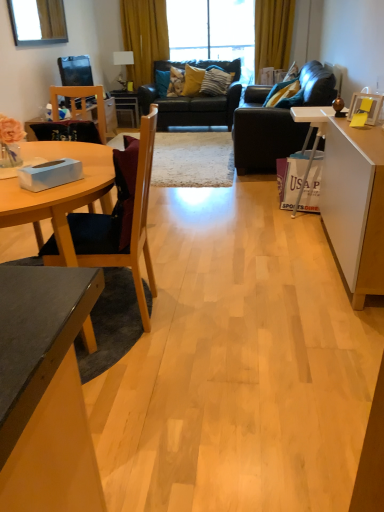
This screenshot has width=384, height=512. Identify the location of dark brown leather couch at right, the 2th studio couch in the back-to-front sequence. (278, 120).

Locate an element on the screen. The width and height of the screenshot is (384, 512). wooden picture frame at right is located at coordinates (370, 108).

This screenshot has width=384, height=512. Describe the element at coordinates (352, 199) in the screenshot. I see `white glossy cabinet at right` at that location.

The height and width of the screenshot is (512, 384). Describe the element at coordinates (113, 225) in the screenshot. I see `wooden chair at left, the 1th chair in the right-to-left sequence` at that location.

Measure the distance between point (x=142, y=1) and camera.

A distance of 5.75 meters exists between point (x=142, y=1) and camera.

This screenshot has height=512, width=384. Identify the location of yellow fabric curtain at upper center, which appears as the 2th curtain when viewed from the right. (144, 37).

The width and height of the screenshot is (384, 512). What do you see at coordinates (176, 82) in the screenshot? I see `velvet yellow pillow at center, acting as the fourth pillow starting from the front` at bounding box center [176, 82].

I want to click on metallic silver side table at center, so click(127, 105).

Consider the image. Is metallic silver side table at center completely or partially outside of velvet yellow pillow at center, acting as the fourth pillow starting from the right?

That's correct, metallic silver side table at center is outside of velvet yellow pillow at center, acting as the fourth pillow starting from the right.

Can you confirm if metallic silver side table at center is taller than velvet yellow pillow at center, acting as the fourth pillow starting from the right?

Yes, metallic silver side table at center is taller than velvet yellow pillow at center, acting as the fourth pillow starting from the right.

Is velvet yellow pillow at center, acting as the first pillow starting from the left, at the back of metallic silver side table at center?

metallic silver side table at center does not have its back to velvet yellow pillow at center, acting as the first pillow starting from the left.

Consider the image. From a real-world perspective, is black leather couch at center, marked as the second studio couch in a front-to-back arrangement, above or below wooden chair at left, placed as the first chair when sorted from top to bottom?

black leather couch at center, marked as the second studio couch in a front-to-back arrangement, is below wooden chair at left, placed as the first chair when sorted from top to bottom.

Is there a large distance between black leather couch at center, marked as the second studio couch in a front-to-back arrangement, and wooden chair at left, the second chair ordered from the bottom?

That's right, there is a large distance between black leather couch at center, marked as the second studio couch in a front-to-back arrangement, and wooden chair at left, the second chair ordered from the bottom.

Is black leather couch at center, which is the 1th studio couch from back to front, spatially inside wooden chair at left, which is the second chair in right-to-left order, or outside of it?

black leather couch at center, which is the 1th studio couch from back to front, cannot be found inside wooden chair at left, which is the second chair in right-to-left order.

Which of these two, black leather couch at center, which is the 1th studio couch from back to front, or wooden chair at left, which appears as the first chair when viewed from the back, is bigger?

black leather couch at center, which is the 1th studio couch from back to front, is bigger.

How many degrees apart are the facing directions of transparent glass window at upper center and black leather couch at center, marked as the second studio couch in a front-to-back arrangement?

There is a 1.34-degree angle between the facing directions of transparent glass window at upper center and black leather couch at center, marked as the second studio couch in a front-to-back arrangement.

Is transparent glass window at upper center not within black leather couch at center, which is the 1th studio couch from back to front?

Absolutely, transparent glass window at upper center is external to black leather couch at center, which is the 1th studio couch from back to front.

Which object is positioned more to the right, transparent glass window at upper center or black leather couch at center, which is the 1th studio couch from back to front?

Positioned to the right is transparent glass window at upper center.

Considering their positions, is matte white lamp at upper center located in front of or behind black leather couch at center, which is the 1th studio couch from back to front?

Visually, matte white lamp at upper center is located behind black leather couch at center, which is the 1th studio couch from back to front.

From a real-world perspective, which is physically above, matte white lamp at upper center or black leather couch at center, which is the 1th studio couch from back to front?

In real-world perspective, matte white lamp at upper center is above.

Who is taller, matte white lamp at upper center or black leather couch at center, marked as the second studio couch in a front-to-back arrangement?

black leather couch at center, marked as the second studio couch in a front-to-back arrangement, is taller.

Considering the relative sizes of velvet yellow pillow at center, which is counted as the first pillow, starting from the back, and wooden picture frame at right in the image provided, is velvet yellow pillow at center, which is counted as the first pillow, starting from the back, smaller than wooden picture frame at right?

No, velvet yellow pillow at center, which is counted as the first pillow, starting from the back, is not smaller than wooden picture frame at right.

Considering the relative sizes of velvet yellow pillow at center, acting as the first pillow starting from the left, and wooden picture frame at right in the image provided, is velvet yellow pillow at center, acting as the first pillow starting from the left, wider than wooden picture frame at right?

Yes, velvet yellow pillow at center, acting as the first pillow starting from the left, is wider than wooden picture frame at right.

Considering the sizes of objects velvet yellow pillow at center, acting as the first pillow starting from the left, and wooden picture frame at right in the image provided, who is taller, velvet yellow pillow at center, acting as the first pillow starting from the left, or wooden picture frame at right?

velvet yellow pillow at center, acting as the first pillow starting from the left, is taller.

Is velvet yellow pillow at center, acting as the first pillow starting from the left, not near wooden picture frame at right?

velvet yellow pillow at center, acting as the first pillow starting from the left, is far away from wooden picture frame at right.

Is black leather couch at center, marked as the second studio couch in a front-to-back arrangement, surrounding metallic silver side table at center?

No, black leather couch at center, marked as the second studio couch in a front-to-back arrangement, does not contain metallic silver side table at center.

From a real-world perspective, is black leather couch at center, which is the 1th studio couch from back to front, located higher than metallic silver side table at center?

Indeed, from a real-world perspective, black leather couch at center, which is the 1th studio couch from back to front, stands above metallic silver side table at center.

Does black leather couch at center, marked as the second studio couch in a front-to-back arrangement, have a larger size compared to metallic silver side table at center?

Yes.

Which point is more distant from viewer, (155, 78) or (121, 105)?

Point (155, 78)

From the image's perspective, is matte white lamp at upper center below clear glass window at upper left?

No, from the image's perspective, matte white lamp at upper center is not beneath clear glass window at upper left.

Does matte white lamp at upper center have a smaller size compared to clear glass window at upper left?

Correct, matte white lamp at upper center occupies less space than clear glass window at upper left.

Locate an element on the screen. The height and width of the screenshot is (512, 384). window screen that appears on the left of matte white lamp at upper center is located at coordinates (38, 21).

Is point (114, 52) positioned behind point (19, 20)?

That is True.

Find the location of a particular element. side table located behind the velvet yellow pillow at center, acting as the fourth pillow starting from the front is located at coordinates (127, 105).

The height and width of the screenshot is (512, 384). Find the location of `studio couch that is the 2nd one when counting upward from the wooden chair at left, which is the second chair in right-to-left order (from the image's perspective)`. studio couch that is the 2nd one when counting upward from the wooden chair at left, which is the second chair in right-to-left order (from the image's perspective) is located at coordinates (193, 100).

Estimate the real-world distances between objects in this image. Which object is closer to metallic silver side table at center, yellow fabric curtain at upper center, which ranks as the first curtain in left-to-right order, or wooden picture frame at right?

yellow fabric curtain at upper center, which ranks as the first curtain in left-to-right order, is positioned closer to the anchor metallic silver side table at center.

From the image, which object appears to be nearer to transparent glass window at upper center, black leather couch at center, which is the 1th studio couch from back to front, or yellow fabric curtain at upper center, the second curtain viewed from the left?

black leather couch at center, which is the 1th studio couch from back to front.

Looking at the image, which one is located further to velvet yellow pillow at center, which is counted as the first pillow, starting from the back, velvet blue pillow at upper right, the 4th pillow viewed from the left, or striped fabric pillow at center, which is the third pillow in back-to-front order?

velvet blue pillow at upper right, the 4th pillow viewed from the left, is further to velvet yellow pillow at center, which is counted as the first pillow, starting from the back.

From the image, which object appears to be farther from velvet yellow pillow at center, acting as the first pillow starting from the left, striped fabric pillow at center, the 3th pillow when ordered from left to right, or wooden chair at left, the 1th chair in the right-to-left sequence?

wooden chair at left, the 1th chair in the right-to-left sequence.

Based on their spatial positions, is wooden chair at left, arranged as the 2th chair when viewed from the top, or yellow fabric curtain at upper center, which ranks as the first curtain in left-to-right order, further from black leather couch at center, marked as the second studio couch in a front-to-back arrangement?

Based on the image, wooden chair at left, arranged as the 2th chair when viewed from the top, appears to be further to black leather couch at center, marked as the second studio couch in a front-to-back arrangement.

Looking at the image, which one is located further to velvet blue pillow at upper right, arranged as the first pillow when viewed from the right, striped fabric pillow at center, which is counted as the 2th pillow, starting from the front, or metallic silver side table at center?

metallic silver side table at center is further to velvet blue pillow at upper right, arranged as the first pillow when viewed from the right.

Estimate the real-world distances between objects in this image. Which object is closer to clear glass window at upper left, velvet blue pillow at upper right, which is the 4th pillow from back to front, or yellow fabric curtain at upper center, which appears as the 2th curtain when viewed from the right?

Among the two, yellow fabric curtain at upper center, which appears as the 2th curtain when viewed from the right, is located nearer to clear glass window at upper left.

Which object lies nearer to the anchor point yellow fabric curtain at upper center, the second curtain viewed from the left, yellow fabric curtain at upper center, which appears as the 2th curtain when viewed from the right, or light wood/finished coffee table at lower left?

Based on the image, yellow fabric curtain at upper center, which appears as the 2th curtain when viewed from the right, appears to be nearer to yellow fabric curtain at upper center, the second curtain viewed from the left.

Identify the location of lamp between velvet blue pillow at upper right, which is the 4th pillow from back to front, and transparent glass window at upper center in the front-back direction. The width and height of the screenshot is (384, 512). (122, 64).

What are the coordinates of `curtain between velvet blue pillow at upper right, the 4th pillow viewed from the left, and striped fabric pillow at center, which is the third pillow in back-to-front order, in the front-back direction` in the screenshot? It's located at (273, 34).

What are the coordinates of `curtain between matte white lamp at upper center and striped fabric pillow at center, which is the third pillow in back-to-front order, from left to right` in the screenshot? It's located at (144, 37).

Image resolution: width=384 pixels, height=512 pixels. I want to click on chair between white glossy cabinet at right and transparent glass window at upper center from front to back, so click(82, 105).